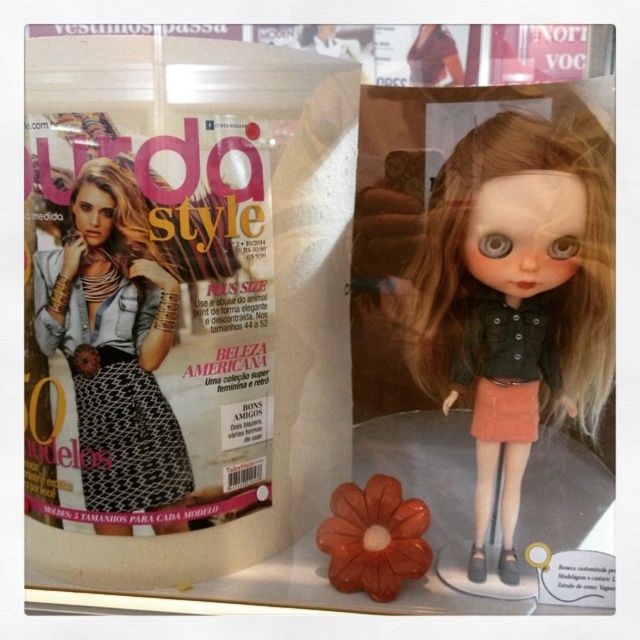
You are a fashion designer who wants to place both the matte black doll at center and the matte black dress at center on a display stand. Given that the stand can only accommodate one object at a time, which object should you choose to fit the stand if the stand is designed to hold larger items?

The matte black doll at center is larger in size than the matte black dress at center, so you should choose the matte black doll at center to fit the stand since it is designed for larger items.

You are a fashion designer who wants to display the matte black doll at center and the black textured dress at center on a mannequin stand. The stand can only hold items up to 30 cm tall. Which item should you choose to ensure it fits on the stand?

The black textured dress at center should be chosen because the matte black doll at center is taller than it, and the stand can only accommodate items up to 30 cm in height.